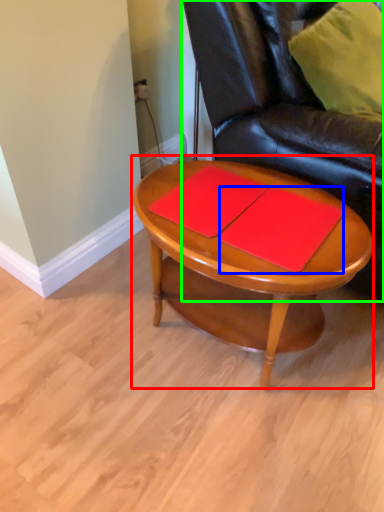
Question: Based on their relative distances, which object is farther from coffee table (highlighted by a red box)? Choose from notebook (highlighted by a blue box) and chair (highlighted by a green box).

Choices:
 (A) notebook
 (B) chair

Answer: (B)